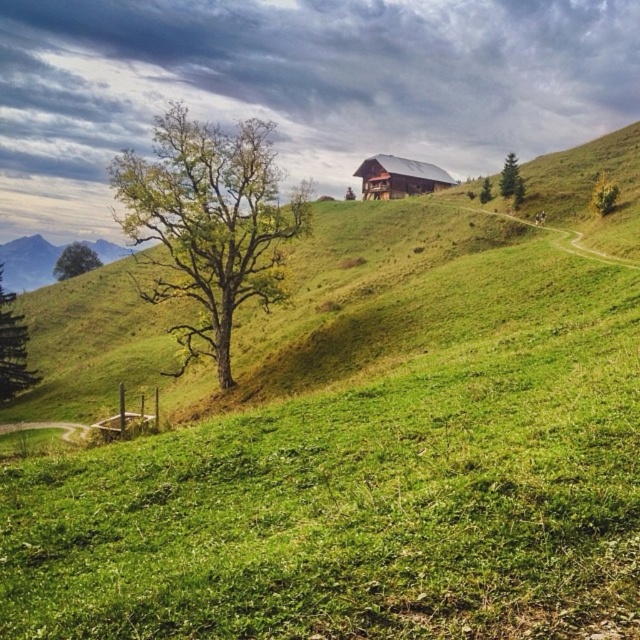
Can you confirm if brown wooden hut at center is bigger than green matte tree at left?

Correct, brown wooden hut at center is larger in size than green matte tree at left.

Can you confirm if brown wooden hut at center is wider than green matte tree at left?

No, brown wooden hut at center is not wider than green matte tree at left.

Between point (419, 182) and point (72, 250), which one is positioned behind?

Positioned behind is point (72, 250).

This screenshot has width=640, height=640. I want to click on brown wooden hut at center, so click(x=400, y=177).

Where is `green leafy tree at upper right`? green leafy tree at upper right is located at coordinates [604, 195].

Between point (609, 186) and point (509, 172), which one is positioned in front?

Point (609, 186) is in front.

Who is more distant from viewer, (604, 211) or (509, 186)?

The point (509, 186) is behind.

Locate an element on the screen. The width and height of the screenshot is (640, 640). green leafy tree at upper right is located at coordinates (604, 195).

Between brown wooden hut at center and green leafy tree at upper center, which one has less height?

With less height is green leafy tree at upper center.

Find the location of a particular element. The width and height of the screenshot is (640, 640). brown wooden hut at center is located at coordinates (400, 177).